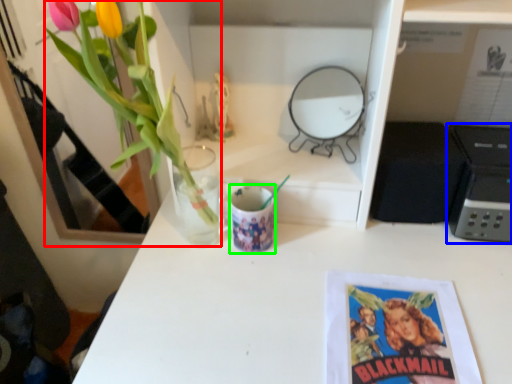
Question: Which object is the closest to the floral arrangement (highlighted by a red box)? Choose among these: appliance (highlighted by a blue box) or mug (highlighted by a green box).

Choices:
 (A) appliance
 (B) mug

Answer: (B)